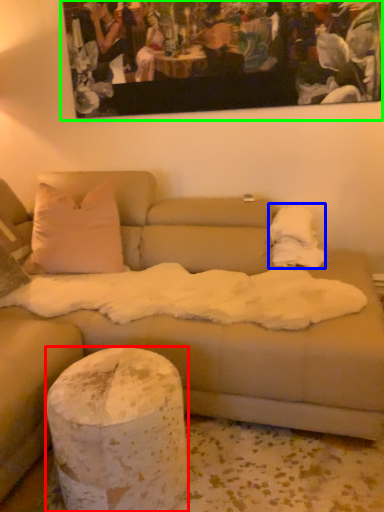
Question: Based on their relative distances, which object is farther from pillar (highlighted by a red box)? Choose from blanket (highlighted by a blue box) and picture frame (highlighted by a green box).

Choices:
 (A) blanket
 (B) picture frame

Answer: (B)